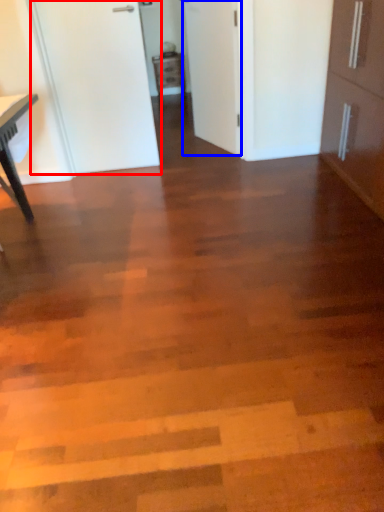
Question: Among these objects, which one is farthest to the camera, door (highlighted by a red box) or door (highlighted by a blue box)?

Choices:
 (A) door
 (B) door

Answer: (B)